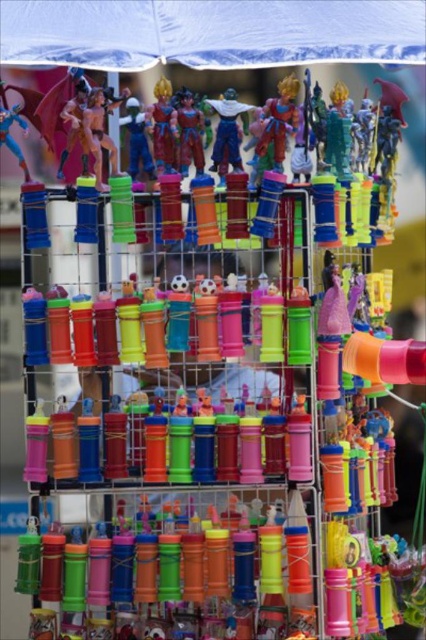
You are a customer at a toy store looking at the metal shelving unit. You see the matte plastic action figure at center and the shiny plastic figure at center. Which one is positioned lower on the shelf?

The matte plastic action figure at center is positioned lower because it is located below the shiny plastic figure at center.

You are setting up a display for a toy store and need to place both the matte plastic action figure at center and the shiny plastic action figure at center on a shelf. Based on their widths, which one requires more space horizontally?

The matte plastic action figure at center might be wider than the shiny plastic action figure at center, so it requires more horizontal space.